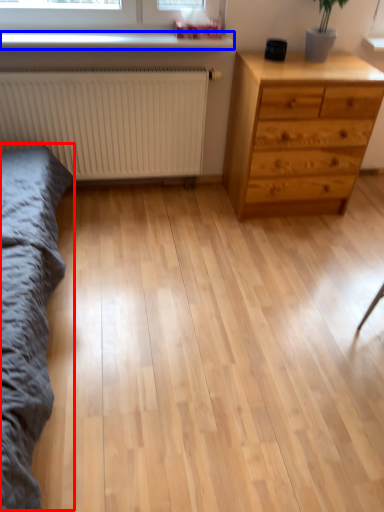
Question: Which of the following is the farthest to the observer, bed frame (highlighted by a red box) or window sill (highlighted by a blue box)?

Choices:
 (A) bed frame
 (B) window sill

Answer: (B)